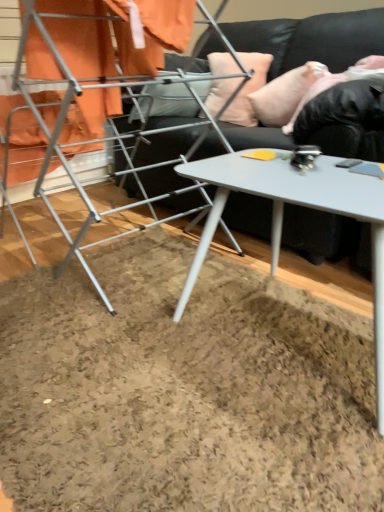
Question: From a real-world perspective, is black leather couch at upper center positioned under pink fabric pillow at upper right, placed as the 2th pillow when sorted from left to right, based on gravity?

Choices:
 (A) no
 (B) yes

Answer: (B)

Question: Does black leather couch at upper center have a greater width compared to pink fabric pillow at upper right, placed as the 2th pillow when sorted from left to right?

Choices:
 (A) no
 (B) yes

Answer: (B)

Question: From the image's perspective, does black leather couch at upper center appear higher than pink fabric pillow at upper right, placed as the 2th pillow when sorted from left to right?

Choices:
 (A) yes
 (B) no

Answer: (B)

Question: Does black leather couch at upper center appear on the right side of pink fabric pillow at upper right, marked as the 1th pillow in a right-to-left arrangement?

Choices:
 (A) no
 (B) yes

Answer: (A)

Question: Considering the relative sizes of black leather couch at upper center and pink fabric pillow at upper right, placed as the 2th pillow when sorted from left to right, in the image provided, is black leather couch at upper center thinner than pink fabric pillow at upper right, placed as the 2th pillow when sorted from left to right,?

Choices:
 (A) no
 (B) yes

Answer: (A)

Question: In the image, is black leather couch at upper center on the left side or the right side of white glossy table at center?

Choices:
 (A) left
 (B) right

Answer: (A)

Question: From the image's perspective, is black leather couch at upper center located above or below white glossy table at center?

Choices:
 (A) above
 (B) below

Answer: (A)

Question: In terms of width, does black leather couch at upper center look wider or thinner when compared to white glossy table at center?

Choices:
 (A) wide
 (B) thin

Answer: (A)

Question: From a real-world perspective, is black leather couch at upper center positioned above or below white glossy table at center?

Choices:
 (A) below
 (B) above

Answer: (B)

Question: Considering their positions, is metallic silver drying rack at left located in front of or behind white glossy table at center?

Choices:
 (A) behind
 (B) front

Answer: (A)

Question: From a real-world perspective, is metallic silver drying rack at left physically located above or below white glossy table at center?

Choices:
 (A) below
 (B) above

Answer: (B)

Question: Is metallic silver drying rack at left to the left or to the right of white glossy table at center in the image?

Choices:
 (A) right
 (B) left

Answer: (B)

Question: Considering the positions of metallic silver drying rack at left and white glossy table at center in the image, is metallic silver drying rack at left wider or thinner than white glossy table at center?

Choices:
 (A) thin
 (B) wide

Answer: (B)

Question: From the image's perspective, is white glossy table at center located above or below peach fabric pillow at upper center, which is the 1th pillow from left to right?

Choices:
 (A) below
 (B) above

Answer: (A)

Question: Considering their positions, is white glossy table at center located in front of or behind peach fabric pillow at upper center, the 2th pillow from the right?

Choices:
 (A) front
 (B) behind

Answer: (A)